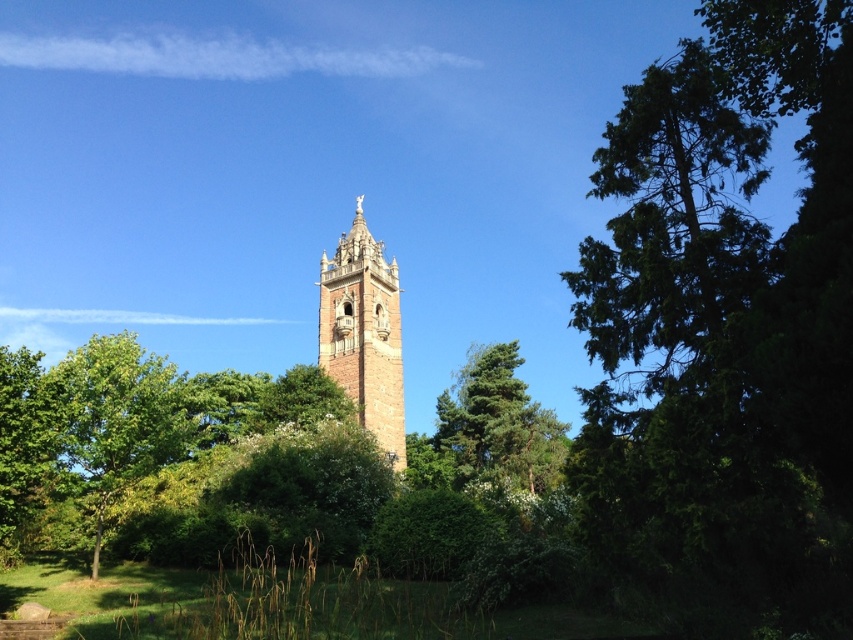
Which is more to the left, green leafy tree at left or green textured tree at center?

Positioned to the left is green leafy tree at left.

Is point (77, 440) positioned after point (459, 436)?

That is False.

The image size is (853, 640). In order to click on green leafy tree at left in this screenshot , I will do `click(115, 419)`.

Looking at this image, does green textured tree at center appear on the right side of brown stone tower at center?

Correct, you'll find green textured tree at center to the right of brown stone tower at center.

Does green textured tree at center appear on the left side of brown stone tower at center?

No, green textured tree at center is not to the left of brown stone tower at center.

Is point (456, 376) farther from camera compared to point (328, 362)?

Yes.

Identify the location of green textured tree at center. The width and height of the screenshot is (853, 640). (489, 429).

The image size is (853, 640). Describe the element at coordinates (115, 419) in the screenshot. I see `green leafy tree at left` at that location.

Does green leafy tree at left have a larger size compared to green leafy bush at center?

Indeed, green leafy tree at left has a larger size compared to green leafy bush at center.

Between point (141, 356) and point (259, 515), which one is positioned behind?

The point (141, 356) is more distant.

The image size is (853, 640). Find the location of `green leafy tree at left`. green leafy tree at left is located at coordinates (115, 419).